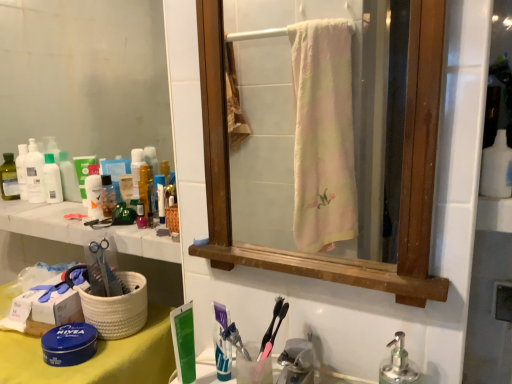
Question: Is matte white lotion at left, the second toiletry viewed from the left, inside or outside of translucent plastic mouthwash at left, which is the first mouthwash from left to right?

Choices:
 (A) inside
 (B) outside

Answer: (B)

Question: Is point click(53, 200) positioned closer to the camera than point click(32, 187)?

Choices:
 (A) farther
 (B) closer

Answer: (B)

Question: Considering the real-world distances, which object is farthest from the white matte bottle at upper right?

Choices:
 (A) white glossy toothpaste at center
 (B) translucent plastic mouthwash at left, the second mouthwash from the right
 (C) matte white lotion at left, the second toiletry viewed from the left
 (D) silver metallic soap dispenser at lower right
 (E) white plastic bottles at upper left

Answer: (B)

Question: Based on their relative distances, which object is nearer to the silver metallic soap dispenser at lower right?

Choices:
 (A) translucent plastic bottles at left, which ranks as the second toiletry in right-to-left order
 (B) white plastic bottles at upper left
 (C) white glossy toothpaste at center
 (D) white matte bottle at upper right
 (E) translucent plastic bottle at upper left, placed as the first mouthwash when sorted from right to left

Answer: (C)